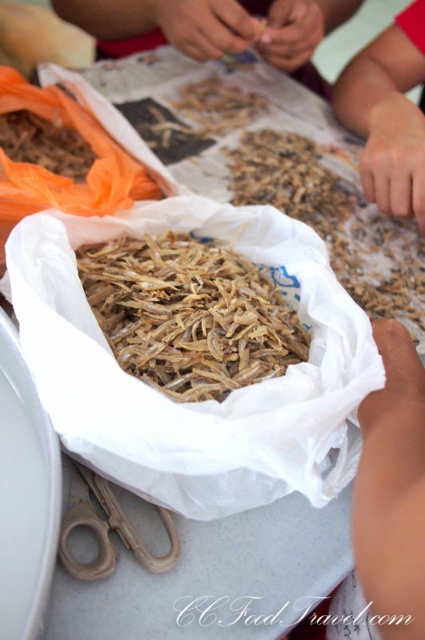
Which is in front, point (170, 308) or point (326, 196)?

Point (170, 308)

Between brown crispy snack at center and brown matte dried shrimp at center, which one appears on the left side from the viewer's perspective?

From the viewer's perspective, brown crispy snack at center appears more on the left side.

Which is behind, point (263, 278) or point (399, 276)?

The point (399, 276) is behind.

Identify the location of brown crispy snack at center. (189, 314).

Is brown matte dried shrimp at center positioned in front of brown paper bag at upper center?

Yes, brown matte dried shrimp at center is in front of brown paper bag at upper center.

Who is more distant from viewer, (249,147) or (308,8)?

Point (249,147)

The height and width of the screenshot is (640, 425). I want to click on brown matte dried shrimp at center, so click(x=334, y=220).

Does brown crispy snack at center appear on the left side of brown wooden scissors at lower left?

Incorrect, brown crispy snack at center is not on the left side of brown wooden scissors at lower left.

Can you confirm if brown crispy snack at center is taller than brown wooden scissors at lower left?

Indeed, brown crispy snack at center has a greater height compared to brown wooden scissors at lower left.

This screenshot has height=640, width=425. What do you see at coordinates (189, 314) in the screenshot?
I see `brown crispy snack at center` at bounding box center [189, 314].

Where is `brown crispy snack at center`? The width and height of the screenshot is (425, 640). brown crispy snack at center is located at coordinates (189, 314).